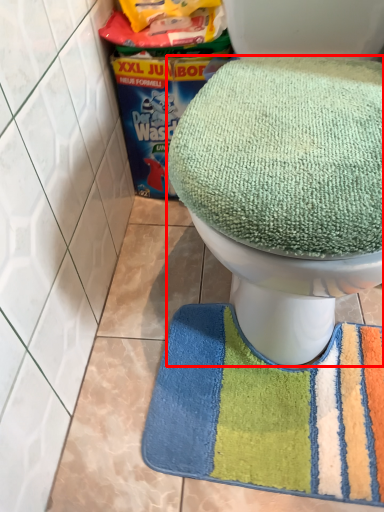
Question: Where is toilet (annotated by the red box) located in relation to bath mat in the image?

Choices:
 (A) left
 (B) right

Answer: (B)